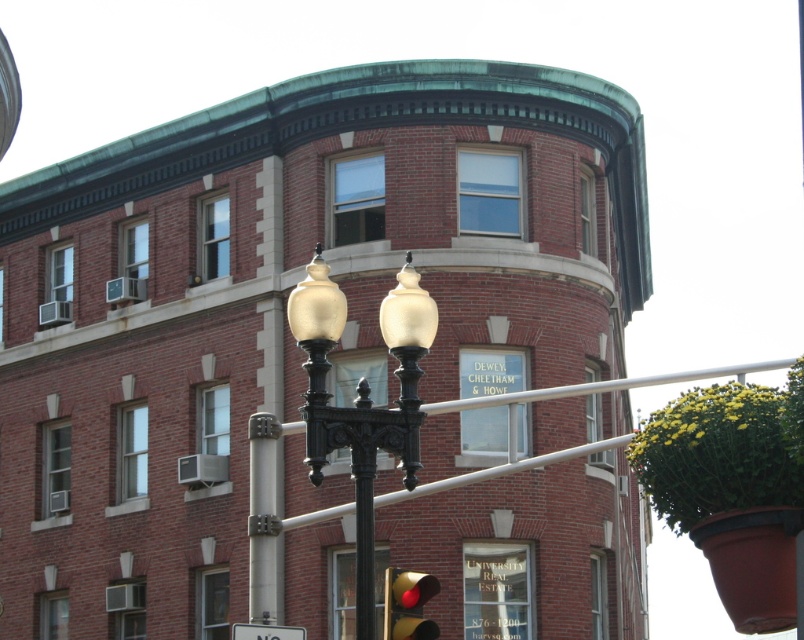
You are standing at the corner of the brick building and want to walk towards the two points marked in the image. Which point, point (408,593) or point (238,637), will you reach first?

Point (408,593) is in front of point (238,637), so you will reach point (408,593) first.

You are a pedestrian standing at the intersection and see the matte red traffic light at lower center and the white plastic sign at lower center. Which object is larger in size?

The matte red traffic light at lower center is smaller than the white plastic sign at lower center, so the white plastic sign at lower center is larger in size.